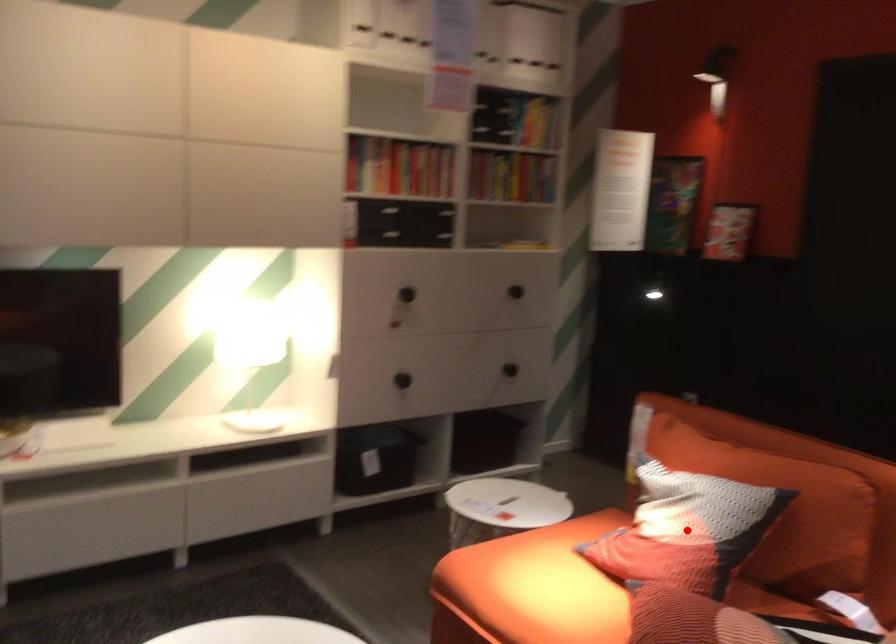
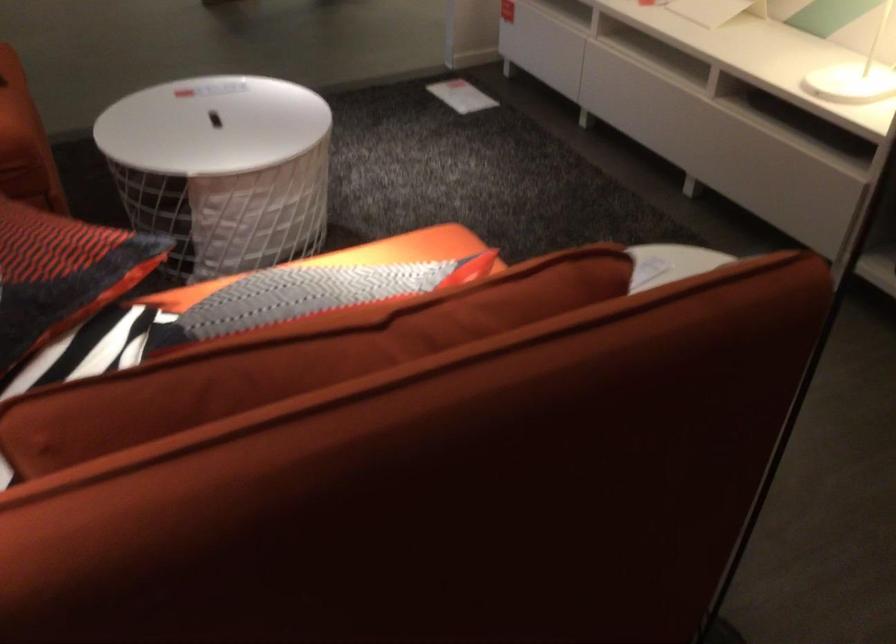
Question: I am providing you with two images of the same scene from different viewpoints. A red point is marked on the first image. Can you still see the location of the red point in image 2?

Choices:
 (A) Yes
 (B) No

Answer: (B)